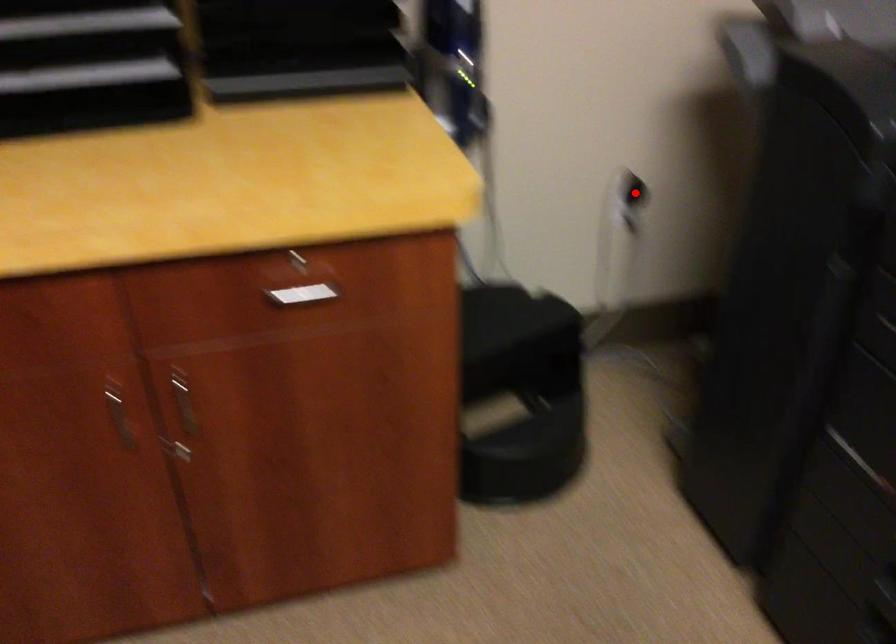
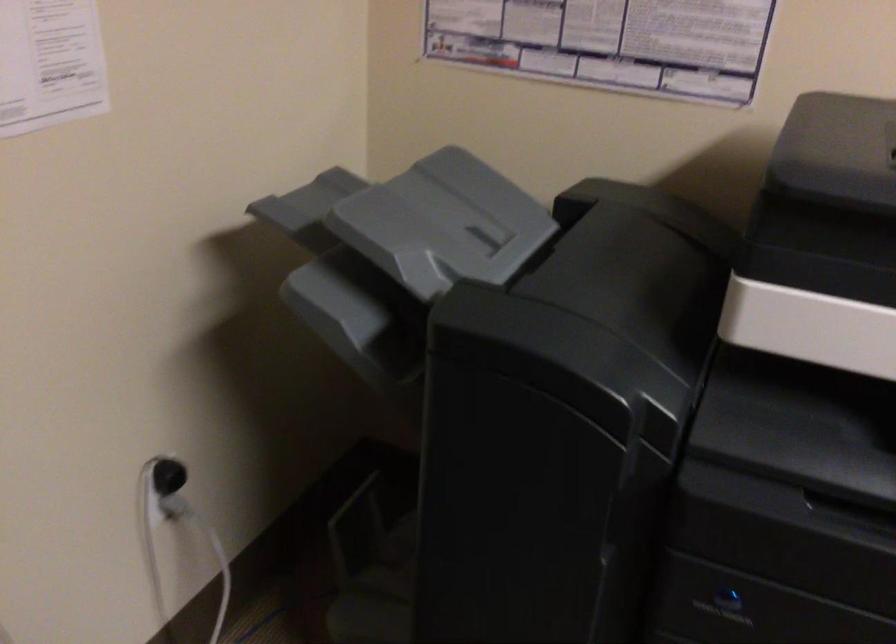
In the second image, find the point that corresponds to the highlighted location in the first image.

(168, 476)